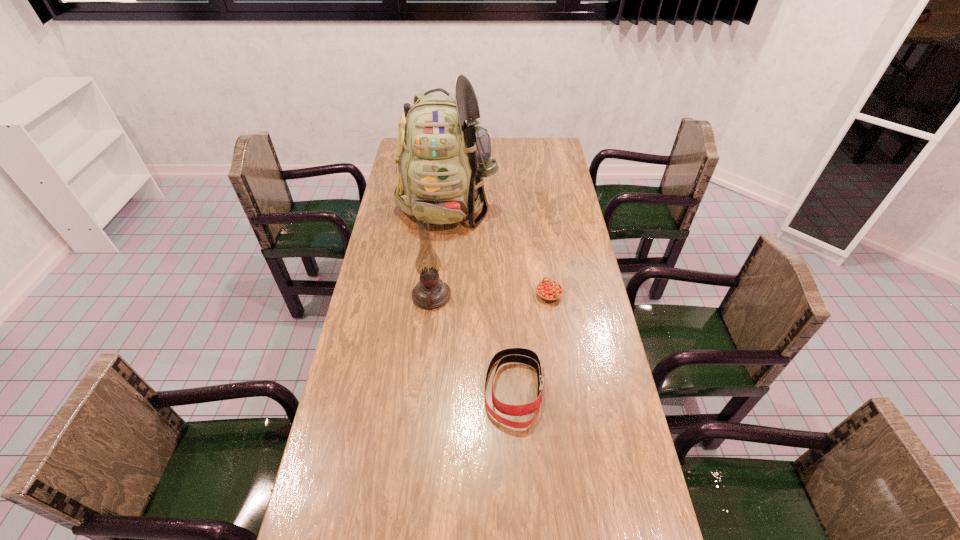
The image size is (960, 540). Identify the location of vacant space that satisfies the following two spatial constraints: 1. on the front-facing side of the dog collar; 2. on the left side of the farthest object. (432, 390).

This screenshot has height=540, width=960. What are the coordinates of `vacant space that satisfies the following two spatial constraints: 1. on the front-facing side of the strawberry; 2. on the left side of the farthest object` in the screenshot? It's located at (440, 295).

Identify the location of free location that satisfies the following two spatial constraints: 1. on the front-facing side of the farthest object; 2. on the right side of the nearest object. The image size is (960, 540). (432, 390).

The image size is (960, 540). What are the coordinates of `free location that satisfies the following two spatial constraints: 1. on the front-facing side of the farthest object; 2. on the left side of the rightmost object` in the screenshot? It's located at (440, 295).

The height and width of the screenshot is (540, 960). Identify the location of free spot that satisfies the following two spatial constraints: 1. on the front-facing side of the nearest object; 2. on the left side of the tallest object. (432, 390).

The height and width of the screenshot is (540, 960). In order to click on free spot that satisfies the following two spatial constraints: 1. on the back side of the oil lamp; 2. on the left side of the rightmost object in this screenshot , I will do `click(432, 295)`.